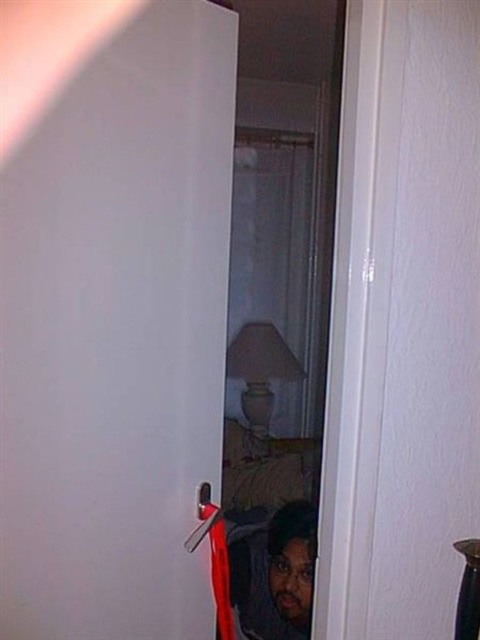
You are standing in front of the white glossy door at center. You want to know if you can reach the door handle without moving your feet. Your arm can extend 3 feet. Can you reach it?

The distance between you and the white glossy door at center is 3.93 feet, which is slightly more than your arm can extend by 3 feet. Therefore, you cannot reach the door handle without moving your feet.

Consider the image. You are a delivery person standing outside the door. You notice the white glossy door at center and the dark brown hair at lower center. Which object is bigger in size?

The white glossy door at center is larger in size compared to the dark brown hair at lower center according to the description.

You are standing outside the room and want to see the dark brown hair at lower center. Can you see it through the white glossy door at center?

The white glossy door at center is positioned over dark brown hair at lower center, so the door is blocking the view of the dark brown hair at lower center. You cannot see it through the door.